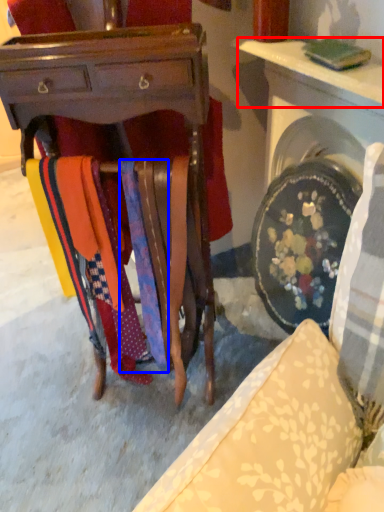
Question: Which point is further to the camera, table (highlighted by a red box) or tie (highlighted by a blue box)?

Choices:
 (A) table
 (B) tie

Answer: (B)